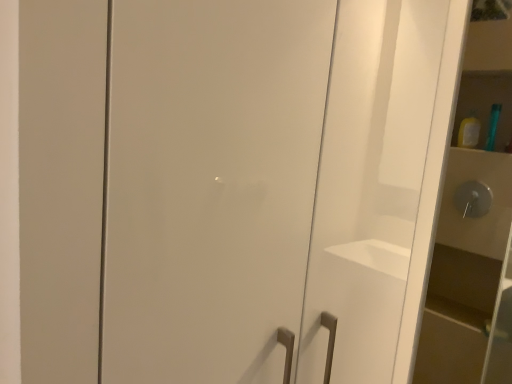
Describe the element at coordinates (210, 185) in the screenshot. This screenshot has width=512, height=384. I see `glossy white cabinet at center` at that location.

The image size is (512, 384). What are the coordinates of `matte white cabinet at right` in the screenshot? It's located at 471,219.

Which is nearer, (x=211, y=271) or (x=503, y=239)?

Point (x=211, y=271).

Is the surface of glossy white cabinet at center in direct contact with matte white cabinet at right?

No, glossy white cabinet at center is not touching matte white cabinet at right.

Is glossy white cabinet at center further to camera compared to matte white cabinet at right?

No, glossy white cabinet at center is closer to the viewer.

Considering the sizes of objects glossy white cabinet at center and matte white cabinet at right in the image provided, who is bigger, glossy white cabinet at center or matte white cabinet at right?

With larger size is matte white cabinet at right.

Does matte white cabinet at right have a greater height compared to glossy white cabinet at center?

Yes.

Would you say matte white cabinet at right is to the left or to the right of glossy white cabinet at center in the picture?

In the image, matte white cabinet at right appears on the right side of glossy white cabinet at center.

Could you tell me if matte white cabinet at right is facing glossy white cabinet at center?

Yes, matte white cabinet at right faces towards glossy white cabinet at center.

Is matte white cabinet at right smaller than glossy white cabinet at center?

Incorrect, matte white cabinet at right is not smaller in size than glossy white cabinet at center.

Consider the image. Is green plastic toothbrush at upper right inside glossy white cabinet at center?

No, green plastic toothbrush at upper right is located outside of glossy white cabinet at center.

Which point is more distant from viewer, (250,327) or (497,105)?

The point (497,105) is more distant.

From a real-world perspective, which is physically below, glossy white cabinet at center or green plastic toothbrush at upper right?

In real-world perspective, glossy white cabinet at center is lower.

Considering the sizes of objects glossy white cabinet at center and green plastic toothbrush at upper right in the image provided, who is thinner, glossy white cabinet at center or green plastic toothbrush at upper right?

glossy white cabinet at center is thinner.

Do you think green plastic toothbrush at upper right is within matte white cabinet at right, or outside of it?

The correct answer is: outside.

Find the location of `cabinetry on the right of green plastic toothbrush at upper right`. cabinetry on the right of green plastic toothbrush at upper right is located at coordinates (471, 219).

Looking at their sizes, would you say green plastic toothbrush at upper right is wider or thinner than matte white cabinet at right?

In the image, green plastic toothbrush at upper right appears to be wider than matte white cabinet at right.

Which is more to the right, green plastic toothbrush at upper right or matte white cabinet at right?

Positioned to the right is matte white cabinet at right.

Is point (423, 317) closer or farther from the camera than point (500, 110)?

Point (423, 317) appears to be closer to the viewer than point (500, 110).

Image resolution: width=512 pixels, height=384 pixels. I want to click on cabinetry in front of the green plastic toothbrush at upper right, so pyautogui.click(x=471, y=219).

Is matte white cabinet at right aimed at green plastic toothbrush at upper right?

Yes, matte white cabinet at right is aimed at green plastic toothbrush at upper right.

Is matte white cabinet at right in front of green plastic toothbrush at upper right?

Yes, matte white cabinet at right is closer to the camera.

From the image's perspective, is green plastic toothbrush at upper right under glossy white cabinet at center?

No, from the image's perspective, green plastic toothbrush at upper right is not below glossy white cabinet at center.

You are a GUI agent. You are given a task and a screenshot of the screen. Output one action in this format:
    pyautogui.click(x=<x>, y=<y>)
    Task: Click on the door located below the green plastic toothbrush at upper right (from the image's perspective)
    The width and height of the screenshot is (512, 384).
    Given the screenshot: What is the action you would take?
    pyautogui.click(x=210, y=185)

Which of these two, green plastic toothbrush at upper right or glossy white cabinet at center, is thinner?

Thinner between the two is glossy white cabinet at center.

Where is `door positioned vertically above the matte white cabinet at right (from a real-world perspective)`? The width and height of the screenshot is (512, 384). door positioned vertically above the matte white cabinet at right (from a real-world perspective) is located at coordinates (210, 185).

The image size is (512, 384). What are the coordinates of `door in front of the matte white cabinet at right` in the screenshot? It's located at (210, 185).

Looking at the image, which one is located closer to glossy white cabinet at center, matte white cabinet at right or green plastic toothbrush at upper right?

matte white cabinet at right is positioned closer to the anchor glossy white cabinet at center.

Based on their spatial positions, is green plastic toothbrush at upper right or glossy white cabinet at center closer to matte white cabinet at right?

green plastic toothbrush at upper right lies closer to matte white cabinet at right than the other object.

From the image, which object appears to be nearer to green plastic toothbrush at upper right, glossy white cabinet at center or matte white cabinet at right?

matte white cabinet at right is positioned closer to the anchor green plastic toothbrush at upper right.

When comparing their distances from green plastic toothbrush at upper right, does matte white cabinet at right or glossy white cabinet at center seem further?

glossy white cabinet at center is further to green plastic toothbrush at upper right.

When comparing their distances from matte white cabinet at right, does glossy white cabinet at center or green plastic toothbrush at upper right seem further?

The object further to matte white cabinet at right is glossy white cabinet at center.

From the image, which object appears to be nearer to glossy white cabinet at center, green plastic toothbrush at upper right or matte white cabinet at right?

matte white cabinet at right lies closer to glossy white cabinet at center than the other object.

Identify the location of cabinetry positioned between glossy white cabinet at center and green plastic toothbrush at upper right from near to far. pos(471,219).